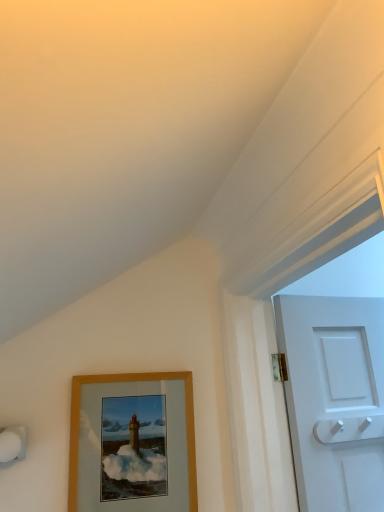
Locate an element on the screen. The height and width of the screenshot is (512, 384). wooden frame at lower left is located at coordinates (131, 381).

Image resolution: width=384 pixels, height=512 pixels. What do you see at coordinates (131, 381) in the screenshot? I see `wooden frame at lower left` at bounding box center [131, 381].

The image size is (384, 512). Describe the element at coordinates (349, 429) in the screenshot. I see `white plastic door handle at right` at that location.

Identify the location of white plastic door handle at right. 349,429.

Locate an element on the screen. Image resolution: width=384 pixels, height=512 pixels. wooden frame at lower left is located at coordinates (131, 381).

Is wooden frame at lower left to the right of white plastic door handle at right from the viewer's perspective?

No, wooden frame at lower left is not to the right of white plastic door handle at right.

Considering their positions, is wooden frame at lower left located in front of or behind white plastic door handle at right?

Visually, wooden frame at lower left is located in front of white plastic door handle at right.

Between point (81, 380) and point (323, 435), which one is positioned in front?

The point (323, 435) is more forward.

From the image's perspective, who appears lower, wooden frame at lower left or white plastic door handle at right?

wooden frame at lower left is shown below in the image.

Based on the photo, from a real-world perspective, which object rests below the other?

wooden frame at lower left, from a real-world perspective.

Which of these two, wooden frame at lower left or white plastic door handle at right, is thinner?

wooden frame at lower left.

Which of these two, wooden frame at lower left or white plastic door handle at right, stands taller?

Standing taller between the two is wooden frame at lower left.

Is wooden frame at lower left smaller than white plastic door handle at right?

No.

Is white plastic door handle at right inside wooden frame at lower left?

No, white plastic door handle at right is not a part of wooden frame at lower left.

Is there a large distance between wooden frame at lower left and white plastic door handle at right?

That's not correct — wooden frame at lower left is a little close to white plastic door handle at right.

Is wooden frame at lower left positioned with its back to white plastic door handle at right?

No, white plastic door handle at right is not at the back of wooden frame at lower left.

How distant is wooden frame at lower left from white plastic door handle at right?

wooden frame at lower left is 48.33 centimeters away from white plastic door handle at right.

The height and width of the screenshot is (512, 384). I want to click on door handle lying behind the wooden frame at lower left, so click(349, 429).

Between white plastic door handle at right and wooden frame at lower left, which one appears on the right side from the viewer's perspective?

Positioned to the right is white plastic door handle at right.

Which object is further away from the camera taking this photo, white plastic door handle at right or wooden frame at lower left?

white plastic door handle at right is further from the camera.

Is point (334, 431) behind point (191, 419)?

No.

From the image's perspective, which one is positioned higher, white plastic door handle at right or wooden frame at lower left?

white plastic door handle at right is shown above in the image.

From a real-world perspective, is white plastic door handle at right physically located above or below wooden frame at lower left?

white plastic door handle at right is situated higher than wooden frame at lower left in the real world.

Is white plastic door handle at right wider than wooden frame at lower left?

Yes, white plastic door handle at right is wider than wooden frame at lower left.

Consider the image. Does white plastic door handle at right have a greater height compared to wooden frame at lower left?

In fact, white plastic door handle at right may be shorter than wooden frame at lower left.

Does white plastic door handle at right have a larger size compared to wooden frame at lower left?

No.

Is white plastic door handle at right completely or partially outside of wooden frame at lower left?

Yes, white plastic door handle at right is located beyond the bounds of wooden frame at lower left.

Is white plastic door handle at right with wooden frame at lower left?

No, white plastic door handle at right is not next to wooden frame at lower left.

Is white plastic door handle at right positioned with its back to wooden frame at lower left?

white plastic door handle at right is not turned away from wooden frame at lower left.

Can you tell me how much white plastic door handle at right and wooden frame at lower left differ in facing direction?

The angle between the facing direction of white plastic door handle at right and the facing direction of wooden frame at lower left is 3.99 degrees.

How far apart are white plastic door handle at right and wooden frame at lower left?

white plastic door handle at right is 19.03 inches from wooden frame at lower left.

Find the location of `door handle on the right of the wooden frame at lower left`. door handle on the right of the wooden frame at lower left is located at coordinates (349, 429).

Image resolution: width=384 pixels, height=512 pixels. I want to click on picture frame below the white plastic door handle at right (from the image's perspective), so click(x=131, y=381).

This screenshot has height=512, width=384. Find the location of `picture frame on the left of white plastic door handle at right`. picture frame on the left of white plastic door handle at right is located at coordinates (131, 381).